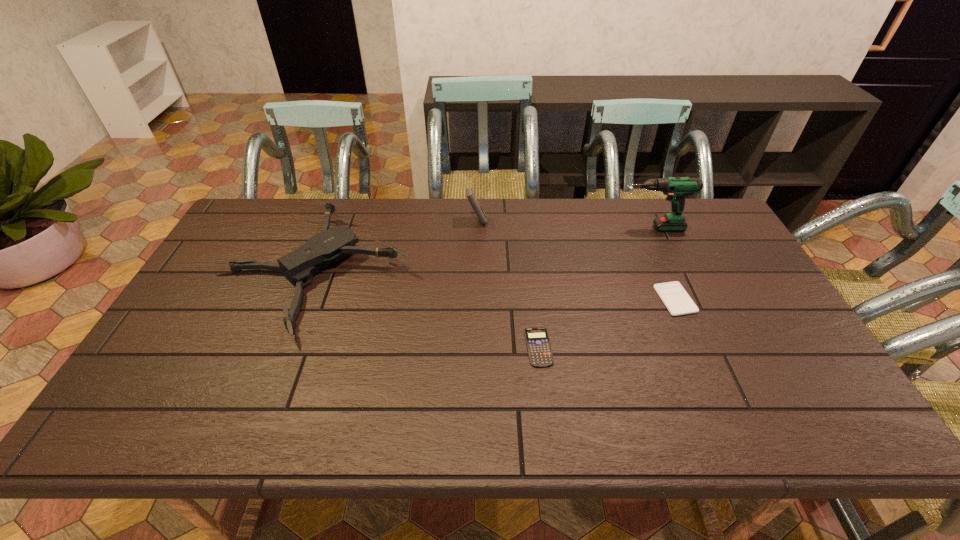
This screenshot has width=960, height=540. Identify the location of vacant area located 0.080m on the handle side of the drill. (593, 228).

Image resolution: width=960 pixels, height=540 pixels. I want to click on vacant region located on the handle side of the drill, so click(552, 228).

Identify the location of vacant space situated 0.230m on the front-facing side of the tallest calculator. Image resolution: width=960 pixels, height=540 pixels. (554, 221).

Where is `vacant region located on the front of the third shortest object`? The height and width of the screenshot is (540, 960). vacant region located on the front of the third shortest object is located at coordinates (262, 401).

At what (x,y) coordinates should I click in order to perform the action: click on free space located 0.090m on the back of the rightmost calculator. Please return your answer as a coordinate pair (x, y). Looking at the image, I should click on (660, 262).

The width and height of the screenshot is (960, 540). I want to click on vacant space situated on the right of the second calculator from left to right, so click(x=611, y=347).

Identify the location of drill located in the far edge section of the desktop. This screenshot has width=960, height=540. (676, 188).

Identify the location of calculator that is at the far edge. The width and height of the screenshot is (960, 540). (470, 195).

This screenshot has width=960, height=540. What are the coordinates of `drone that is at the far edge` in the screenshot? It's located at (320, 251).

You are a GUI agent. You are given a task and a screenshot of the screen. Output one action in this format:
    pyautogui.click(x=<x>, y=<y>)
    Task: Click on the object located in the left edge section of the desktop
    The height and width of the screenshot is (540, 960).
    Given the screenshot: What is the action you would take?
    pyautogui.click(x=320, y=251)